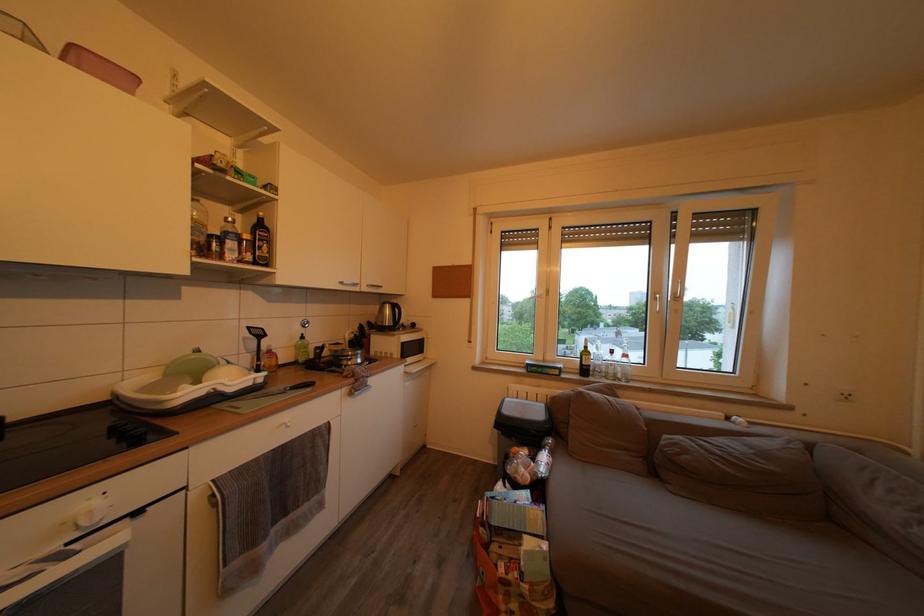
This screenshot has height=616, width=924. Identify the location of black kettle handle. click(x=318, y=352).